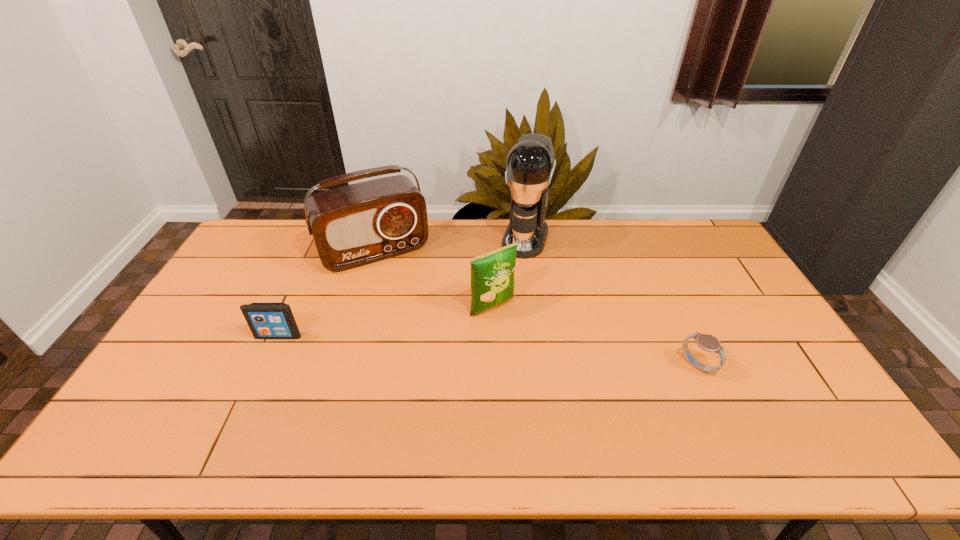
The image size is (960, 540). Find the location of `vacant space located place cup under the spout of the coffee maker`. vacant space located place cup under the spout of the coffee maker is located at coordinates (501, 315).

In order to click on free space located 0.330m place cup under the spout of the coffee maker in this screenshot , I will do `click(498, 324)`.

What are the coordinates of `free location located 0.160m place cup under the spout of the coffee maker` in the screenshot? It's located at (511, 287).

This screenshot has width=960, height=540. I want to click on vacant region located 0.170m on the front panel of the second tallest object, so click(411, 306).

Locate an element on the screen. This screenshot has width=960, height=540. free space located 0.300m on the front panel of the second tallest object is located at coordinates (426, 334).

Where is `free location located 0.140m on the front panel of the second tallest object`? free location located 0.140m on the front panel of the second tallest object is located at coordinates (408, 300).

Identify the location of vacant space located 0.050m on the front-facing side of the crisp (potato chip). The height and width of the screenshot is (540, 960). (515, 328).

Where is `blank area located 0.120m on the front-facing side of the crisp (potato chip)`? This screenshot has width=960, height=540. blank area located 0.120m on the front-facing side of the crisp (potato chip) is located at coordinates (528, 343).

You are a GUI agent. You are given a task and a screenshot of the screen. Output one action in this format:
    pyautogui.click(x=<x>, y=<y>)
    Task: Click on the vacant space located on the front-facing side of the crisp (potato chip)
    
    Given the screenshot: What is the action you would take?
    pyautogui.click(x=560, y=378)

Identify the location of coffee maker that is positioned at the far edge. (530, 164).